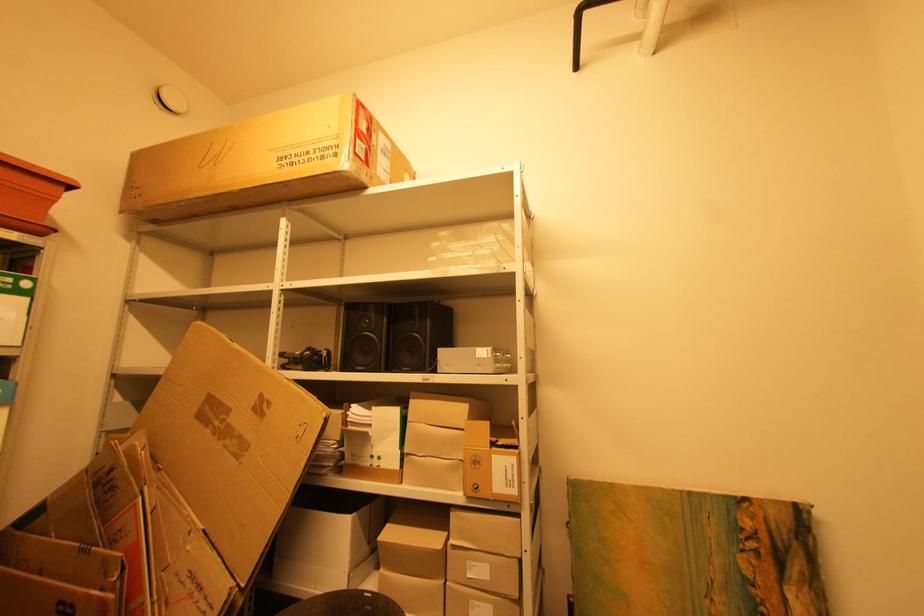
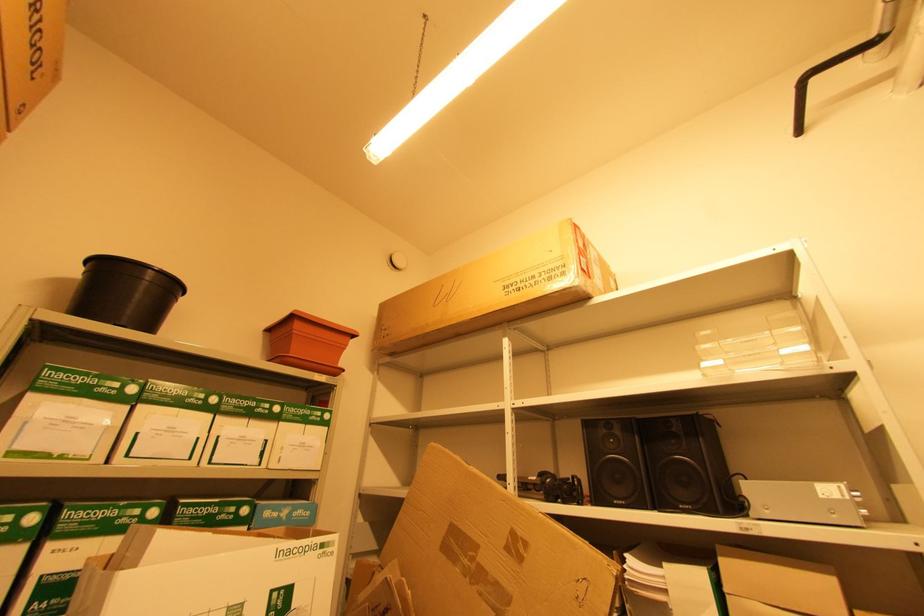
Question: What movement of the cameraman would produce the second image?

Choices:
 (A) Left
 (B) Right
 (C) Forward
 (D) Backward

Answer: (A)